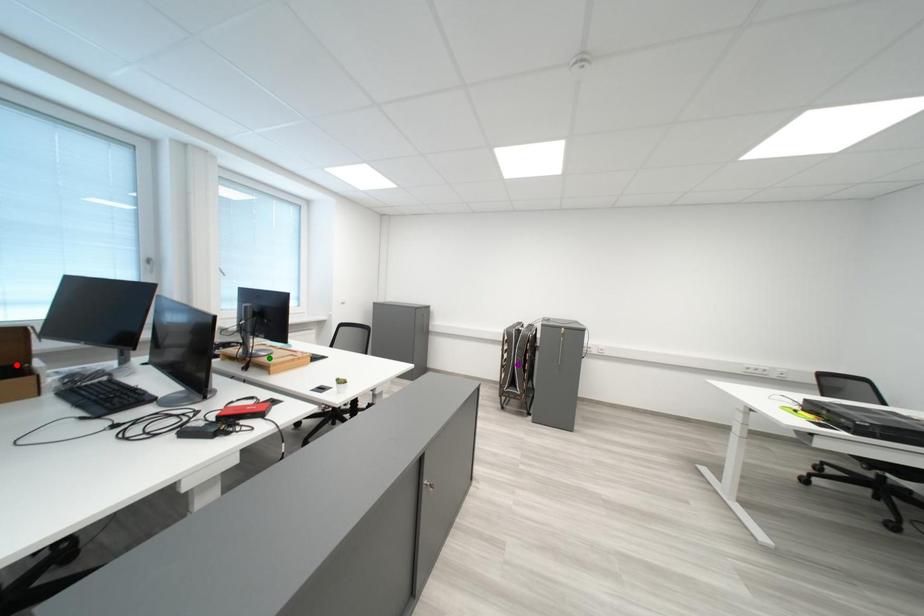
Order these from farthest to nearest:
A) green point
B) red point
C) purple point

purple point → green point → red point